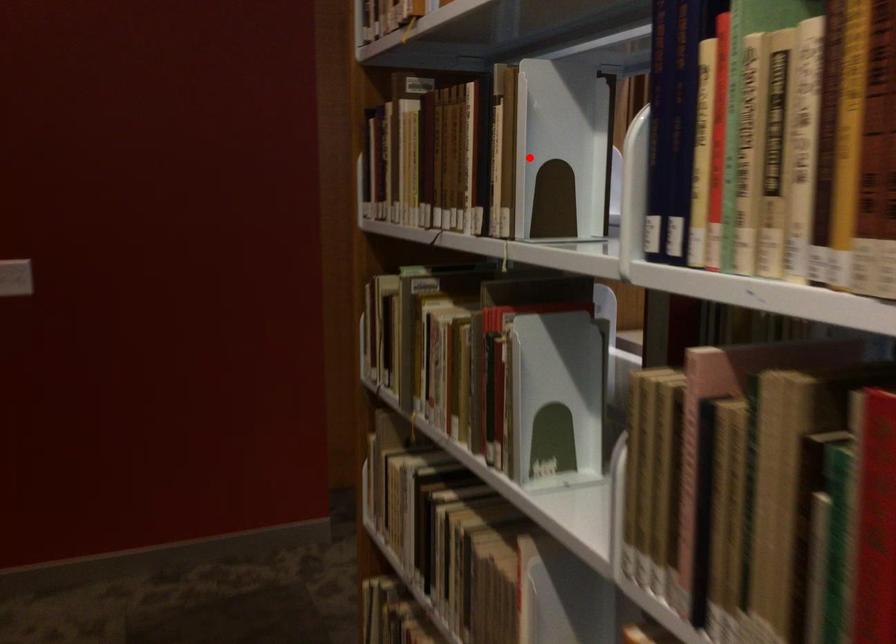
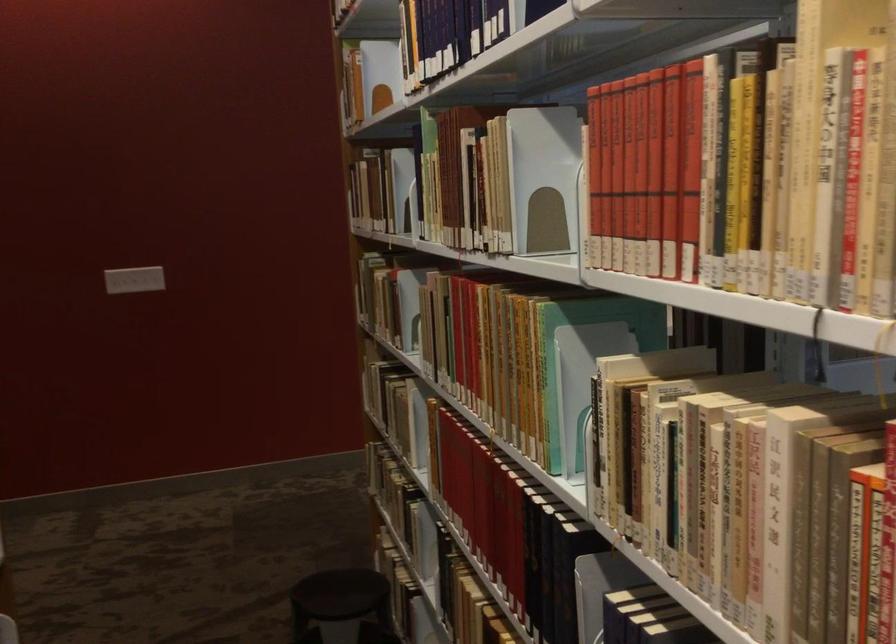
Question: A red point is marked in image1. In image2, is the corresponding 3D point closer to the camera or farther? Reply with the corresponding letter.

Choices:
 (A) The corresponding 3D point is closer.
 (B) The corresponding 3D point is farther.

Answer: (B)